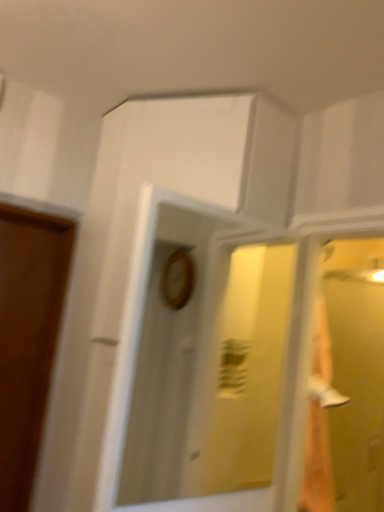
What do you see at coordinates (348, 381) in the screenshot?
I see `transparent glass door at right` at bounding box center [348, 381].

What is the approximate width of transparent glass door at right?

15.62 inches.

Locate an element on the screen. The width and height of the screenshot is (384, 512). transparent glass door at right is located at coordinates (348, 381).

Describe the element at coordinates (197, 358) in the screenshot. I see `wooden clock at center` at that location.

This screenshot has width=384, height=512. What are the coordinates of `wooden clock at center` in the screenshot? It's located at (197, 358).

Identify the location of transparent glass door at right. This screenshot has width=384, height=512. (348, 381).

Can you confirm if wooden clock at center is positioned to the right of transparent glass door at right?

No.

Is wooden clock at center further to the viewer compared to transparent glass door at right?

No, it is in front of transparent glass door at right.

Which is behind, point (252, 319) or point (376, 511)?

The point (252, 319) is farther.

From the image's perspective, is wooden clock at center located above transparent glass door at right?

Yes.

From a real-world perspective, is wooden clock at center positioned above or below transparent glass door at right?

Clearly, from a real-world perspective, wooden clock at center is above transparent glass door at right.

Considering the sizes of objects wooden clock at center and transparent glass door at right in the image provided, who is wider, wooden clock at center or transparent glass door at right?

transparent glass door at right.

Considering the sizes of objects wooden clock at center and transparent glass door at right in the image provided, who is taller, wooden clock at center or transparent glass door at right?

transparent glass door at right.

Is wooden clock at center bigger than transparent glass door at right?

No, wooden clock at center is not bigger than transparent glass door at right.

Do you think wooden clock at center is within transparent glass door at right, or outside of it?

wooden clock at center is not enclosed by transparent glass door at right.

In the scene shown: Is wooden clock at center far from transparent glass door at right?

No, there isn't a large distance between wooden clock at center and transparent glass door at right.

Is wooden clock at center positioned with its back to transparent glass door at right?

No, wooden clock at center is not facing away from transparent glass door at right.

Find the location of a particular element. Image resolution: width=384 pixels, height=512 pixels. glass door on the right of wooden clock at center is located at coordinates (348, 381).

Is transparent glass door at right to the left or to the right of wooden clock at center in the image?

In the image, transparent glass door at right appears on the right side of wooden clock at center.

Which is in front, transparent glass door at right or wooden clock at center?

wooden clock at center is closer to the camera.

Which is less distant, (335, 362) or (174, 339)?

Point (335, 362) appears to be closer to the viewer than point (174, 339).

From the image's perspective, is transparent glass door at right on top of wooden clock at center?

No, from the image's perspective, transparent glass door at right is not on top of wooden clock at center.

From a real-world perspective, is transparent glass door at right on wooden clock at center?

Actually, transparent glass door at right is physically below wooden clock at center in the real world.

Considering the relative sizes of transparent glass door at right and wooden clock at center in the image provided, is transparent glass door at right thinner than wooden clock at center?

Incorrect, the width of transparent glass door at right is not less than that of wooden clock at center.

Is transparent glass door at right taller or shorter than wooden clock at center?

Clearly, transparent glass door at right is taller compared to wooden clock at center.

From the picture: Is transparent glass door at right bigger than wooden clock at center?

Yes.

Choose the correct answer: Is transparent glass door at right inside wooden clock at center or outside it?

The correct answer is: outside.

Is transparent glass door at right placed right next to wooden clock at center?

transparent glass door at right and wooden clock at center are not in contact.

Is transparent glass door at right facing away from wooden clock at center?

No, transparent glass door at right's orientation is not away from wooden clock at center.

Can you tell me how much transparent glass door at right and wooden clock at center differ in facing direction?

There is a 38.7-degree angle between the facing directions of transparent glass door at right and wooden clock at center.

This screenshot has width=384, height=512. Find the location of `glass door that is on the right side of wooden clock at center`. glass door that is on the right side of wooden clock at center is located at coordinates (348, 381).

In the image, there is a wooden clock at center. At what (x,y) coordinates should I click in order to perform the action: click on glass door below it (from a real-world perspective). Please return your answer as a coordinate pair (x, y). Image resolution: width=384 pixels, height=512 pixels. Looking at the image, I should click on (x=348, y=381).

At what (x,y) coordinates should I click in order to perform the action: click on glass door behind the wooden clock at center. Please return your answer as a coordinate pair (x, y). The image size is (384, 512). Looking at the image, I should click on (348, 381).